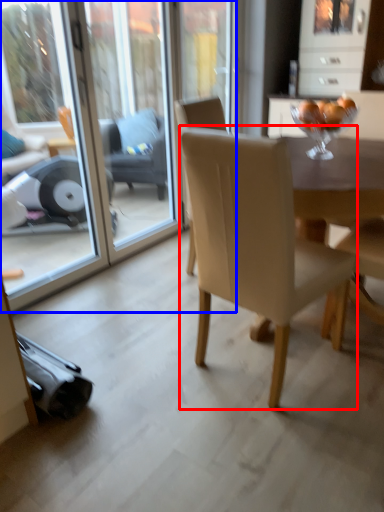
Question: Which of the following is the farthest to the observer, chair (highlighted by a red box) or screen door (highlighted by a blue box)?

Choices:
 (A) chair
 (B) screen door

Answer: (B)